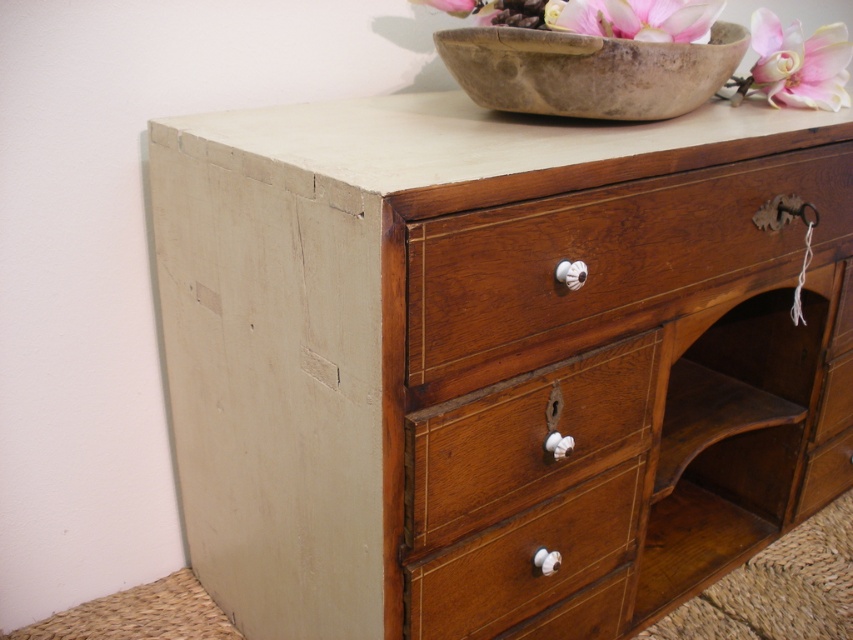
Does wooden drawer at center have a greater width compared to polished wood drawer at center?

Incorrect, wooden drawer at center's width does not surpass polished wood drawer at center's.

Between point (534, 406) and point (619, 538), which one is positioned behind?

Positioned behind is point (619, 538).

Where is `wooden drawer at center`? This screenshot has height=640, width=853. wooden drawer at center is located at coordinates (523, 440).

Does point (688, 26) come in front of point (440, 10)?

Yes, point (688, 26) is closer to viewer.

Does point (664, 29) come behind point (422, 3)?

No, (664, 29) is closer to viewer.

This screenshot has width=853, height=640. Identify the location of pink petal at upper center. (635, 19).

Is mahogany wood drawer at center to the right of pink silk flower at upper right from the viewer's perspective?

Incorrect, mahogany wood drawer at center is not on the right side of pink silk flower at upper right.

Which is behind, point (447, 387) or point (779, 93)?

Positioned behind is point (779, 93).

Locate an element on the screen. mahogany wood drawer at center is located at coordinates (601, 260).